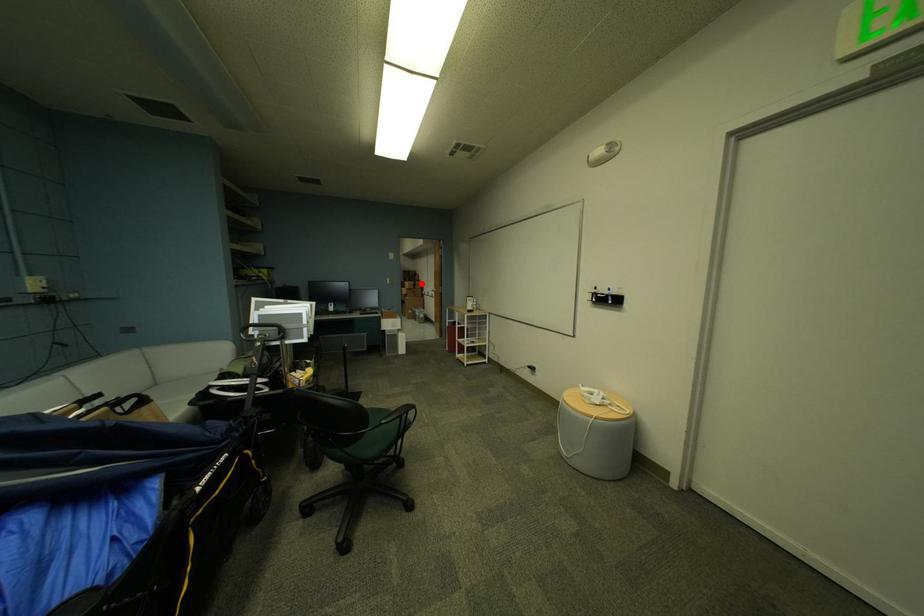
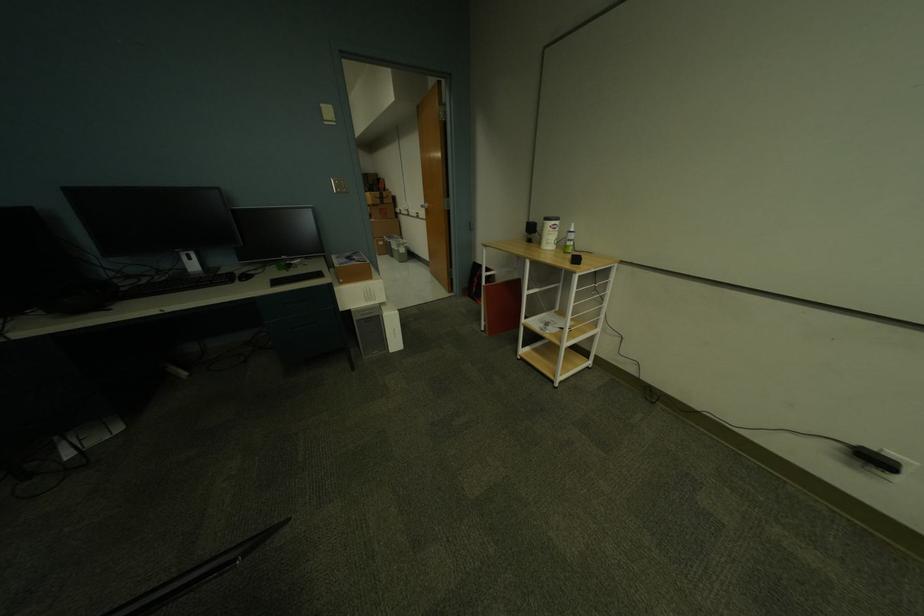
Locate, in the second image, the point that corresponds to the highlighted location in the first image.

(386, 195)